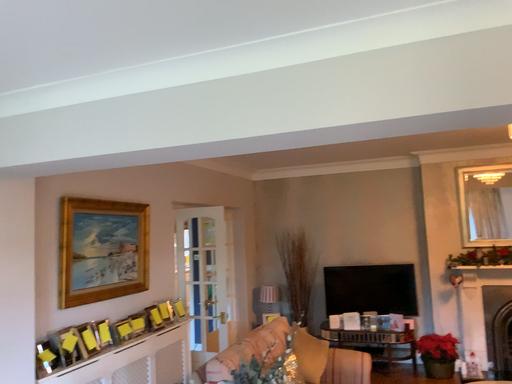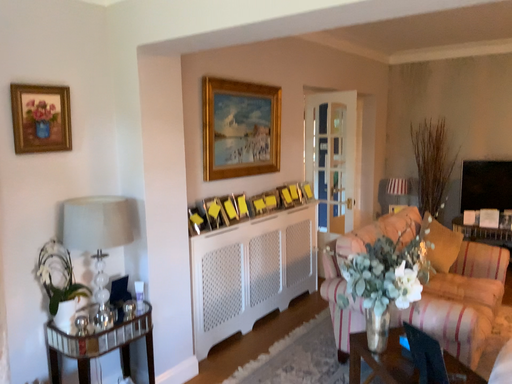
Question: How did the camera likely rotate when shooting the video?

Choices:
 (A) rotated downward
 (B) rotated upward

Answer: (A)